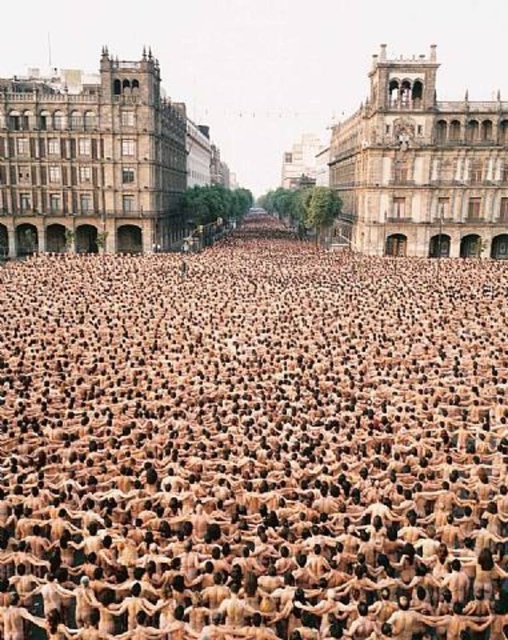
Between point (107, 225) and point (350, 172), which one is positioned behind?

Point (350, 172)

Can you confirm if brown stone building at upper left is bigger than stone/brick building at center?

Indeed, brown stone building at upper left has a larger size compared to stone/brick building at center.

At what (x,y) coordinates should I click in order to perform the action: click on brown stone building at upper left. Please return your answer as a coordinate pair (x, y). The height and width of the screenshot is (640, 508). Looking at the image, I should click on (97, 161).

Between brown human bodies at center and brown stone building at upper left, which one has less height?

brown human bodies at center

Who is taller, brown human bodies at center or brown stone building at upper left?

With more height is brown stone building at upper left.

Locate an element on the screen. Image resolution: width=508 pixels, height=640 pixels. brown human bodies at center is located at coordinates (252, 445).

Which is behind, point (144, 564) or point (400, 212)?

The point (400, 212) is behind.

In the scene shown: Is the position of brown human bodies at center more distant than that of stone/brick building at center?

No.

Find the location of `brown human bodies at center`. brown human bodies at center is located at coordinates [252, 445].